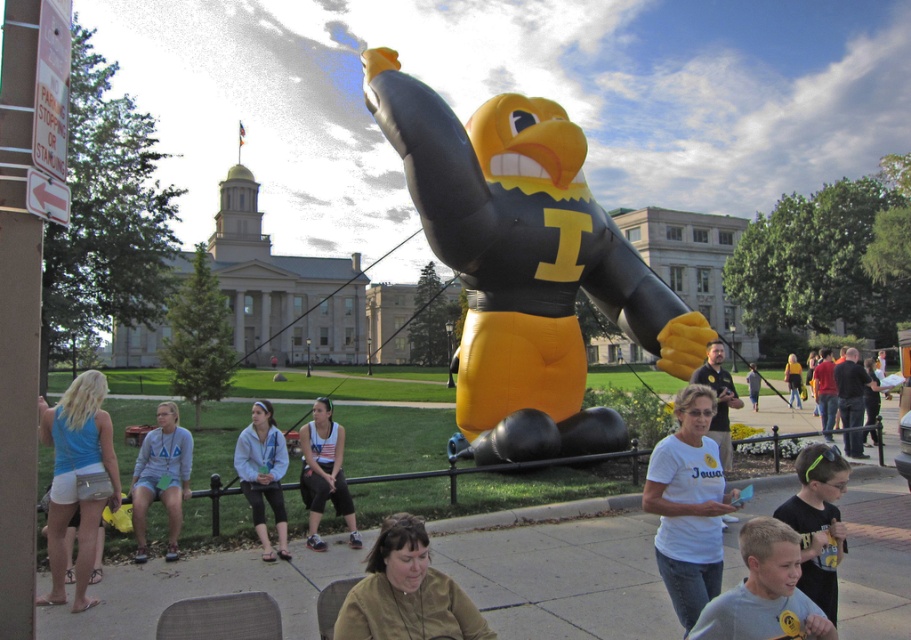
Is point (480, 116) positioned before point (275, 481)?

No, (480, 116) is behind (275, 481).

Is yellow matte inflatable at center taller than light blue hoodie at center?

Correct, yellow matte inflatable at center is much taller as light blue hoodie at center.

Image resolution: width=911 pixels, height=640 pixels. What do you see at coordinates (524, 262) in the screenshot?
I see `yellow matte inflatable at center` at bounding box center [524, 262].

Where is `yellow matte inflatable at center`? The width and height of the screenshot is (911, 640). yellow matte inflatable at center is located at coordinates (524, 262).

Does yellow matte inflatable at center appear on the left side of neon green headband at lower right?

Indeed, yellow matte inflatable at center is positioned on the left side of neon green headband at lower right.

Does yellow matte inflatable at center appear over neon green headband at lower right?

Yes.

This screenshot has width=911, height=640. Identify the location of yellow matte inflatable at center. (524, 262).

Measure the distance between point (819,584) and camera.

A distance of 14.82 feet exists between point (819,584) and camera.

Based on the photo, can you confirm if neon green headband at lower right is positioned to the left of white tank top at center?

Incorrect, neon green headband at lower right is not on the left side of white tank top at center.

Does point (802, 579) come closer to viewer compared to point (306, 472)?

Yes.

I want to click on neon green headband at lower right, so click(817, 522).